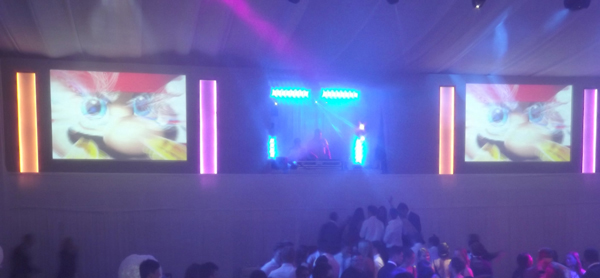
Image resolution: width=600 pixels, height=278 pixels. I want to click on pink light on wall, so click(202, 156), click(593, 156).